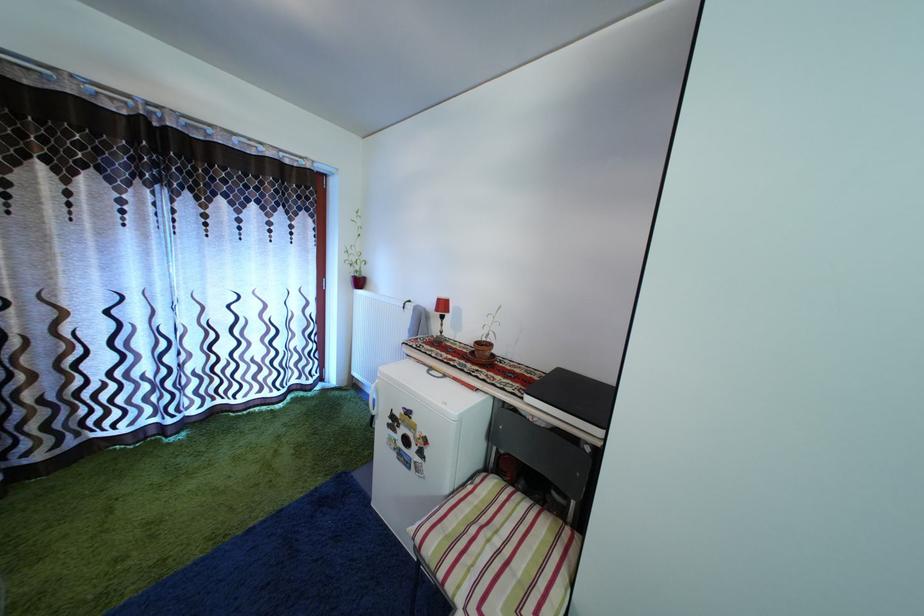
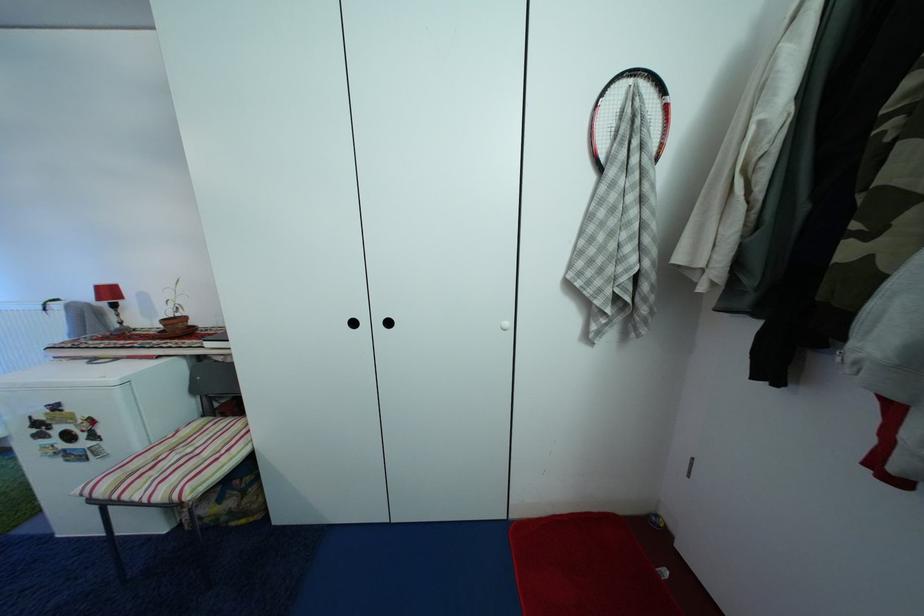
Where in the second image is the point corresponding to (x=485, y=350) from the first image?

(174, 326)